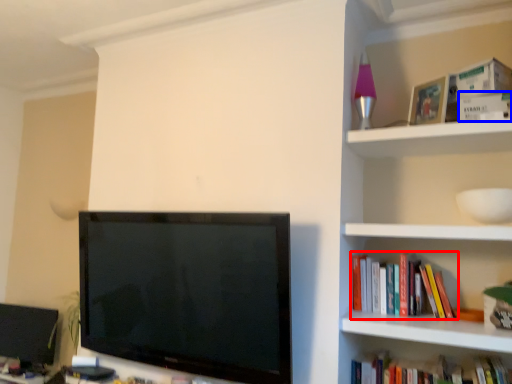
Question: Among these objects, which one is farthest to the camera, book (highlighted by a red box) or paperback book (highlighted by a blue box)?

Choices:
 (A) book
 (B) paperback book

Answer: (A)